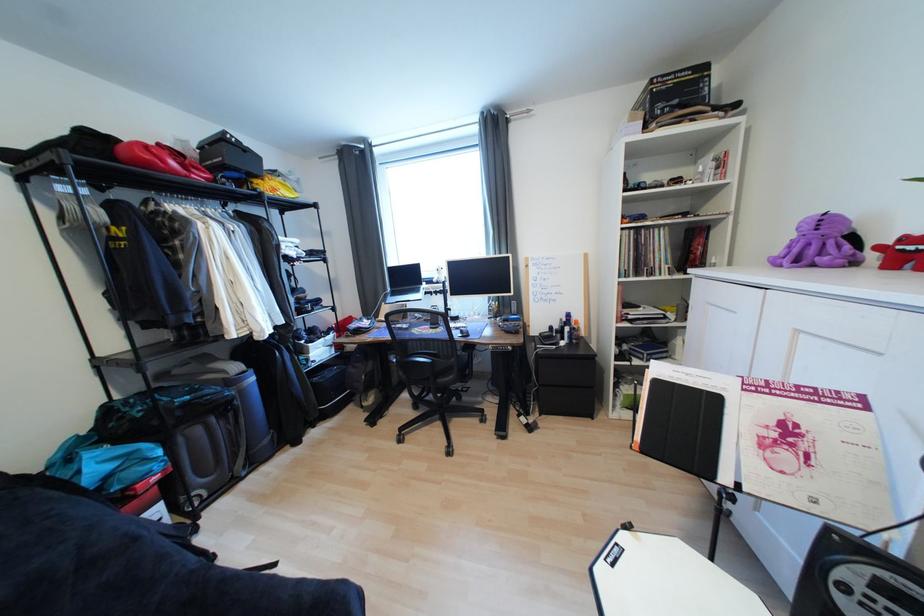
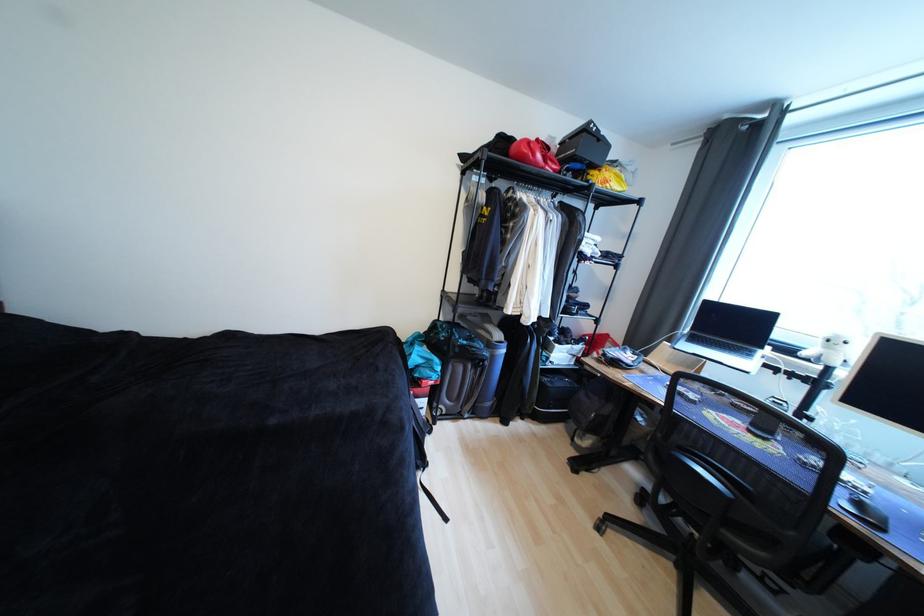
In the second image, find the point that corresponds to [468,333] in the first image.

(867, 506)